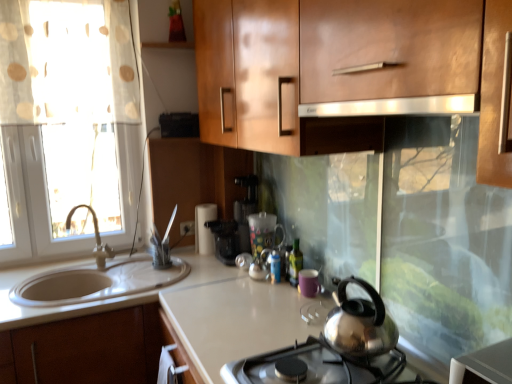
Question: Based on their positions, is white glossy countertop at lower left, the 1th countertop positioned from the left, located to the left or right of black plastic coffee machine at center?

Choices:
 (A) right
 (B) left

Answer: (B)

Question: Looking at their shapes, would you say white glossy countertop at lower left, arranged as the second countertop when viewed from the right, is wider or thinner than black plastic coffee machine at center?

Choices:
 (A) thin
 (B) wide

Answer: (B)

Question: Which object is the farthest from the matte silver faucet at left?

Choices:
 (A) white matte paper towel holder at center, which is the third appliance from front to back
 (B) black plastic coffee machine at center
 (C) glossy wood cabinet at upper center
 (D) polished stainless steel kettle at center
 (E) white glossy countertop at lower left, the 1th countertop positioned from the left

Answer: (D)

Question: Estimate the real-world distances between objects in this image. Which object is farther from the purple matte mug at center, the 1th appliance viewed from the front?

Choices:
 (A) white glossy countertop at lower left, arranged as the second countertop when viewed from the right
 (B) green glass bottle at center
 (C) white matte paper towel holder at center, which is counted as the first appliance, starting from the back
 (D) polished stainless steel kettle at center
 (E) satin silver exhaust hood at upper center

Answer: (E)